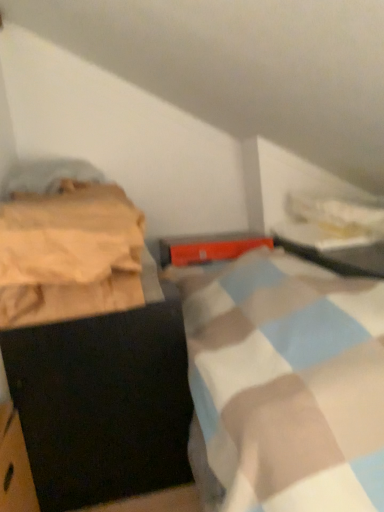
Where is `vacant space underneath beige cotton blanket at left (from a real-world perspective)`? The image size is (384, 512). vacant space underneath beige cotton blanket at left (from a real-world perspective) is located at coordinates (83, 316).